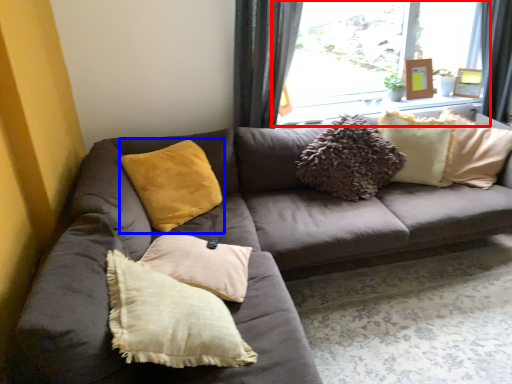
Question: Which object appears farthest to the camera in this image, window (highlighted by a red box) or pillow (highlighted by a blue box)?

Choices:
 (A) window
 (B) pillow

Answer: (A)